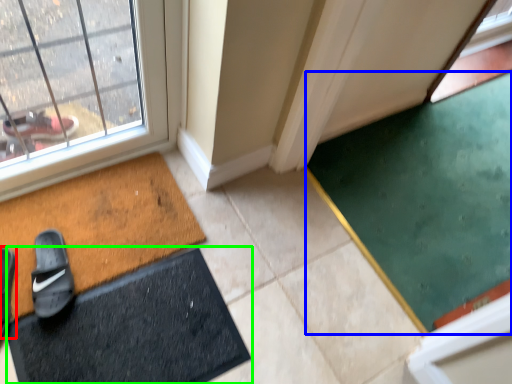
Question: Considering the real-world distances, which object is closest to footwear (highlighted by a red box)? doormat (highlighted by a blue box) or bath mat (highlighted by a green box).

Choices:
 (A) doormat
 (B) bath mat

Answer: (B)